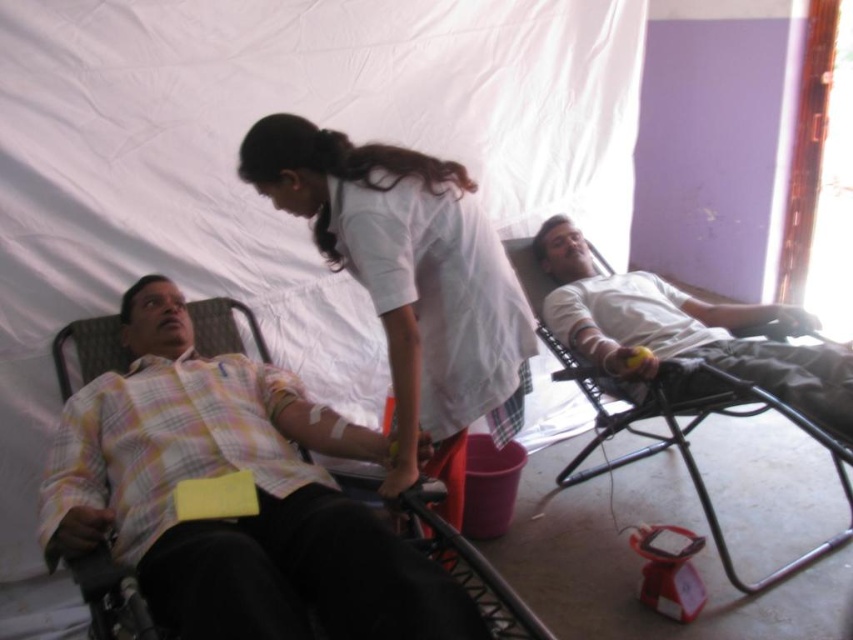
You are a volunteer at the blood donation event and need to check the wrist card of the person in the yellow plaid shirt at left. Which direction should you move to reach them from the white matte shirt at right?

The yellow plaid shirt at left is positioned under the white matte shirt at right, so you should move downward to reach the yellow plaid shirt at left from the white matte shirt at right.

You are standing at the point marked as point [410,244] in the scene. A nurse needs to place a medical kit exactly 6 feet away from this point to ensure proper distance during the blood donation process. Is the current placement of the medical kit at 5.80 feet sufficient? Please explain.

The point marked as point [410,244] and the viewer are 5.80 feet apart. Since the required distance is 6 feet, the current placement is 0.20 feet too close to meet the requirement.